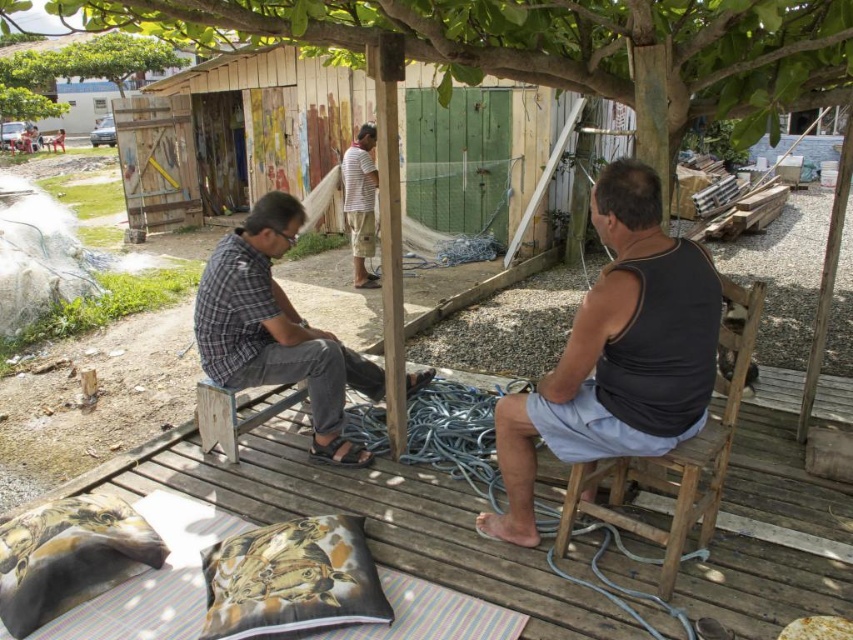
You are standing in front of the wooden platform and want to hand a tool to both the person wearing the black matte tank top at right and the person wearing the plaid fabric shirt at left. Which person should you approach first based on their proximity to you?

You should approach the black matte tank top at right first because it is closer to you than the plaid fabric shirt at left.

Consider the image. You are standing on the wooden platform and need to place a small item on the plaid fabric shirt at left and the printed fabric pillow at lower center. Which object should you place it on if you want it closer to the ground?

You should place the item on the printed fabric pillow at lower center because the plaid fabric shirt at left is above it, making the pillow closer to the ground.

From the picture: What is located at the coordinates point (276, 328)?

The plaid fabric shirt at left is located at point (276, 328).